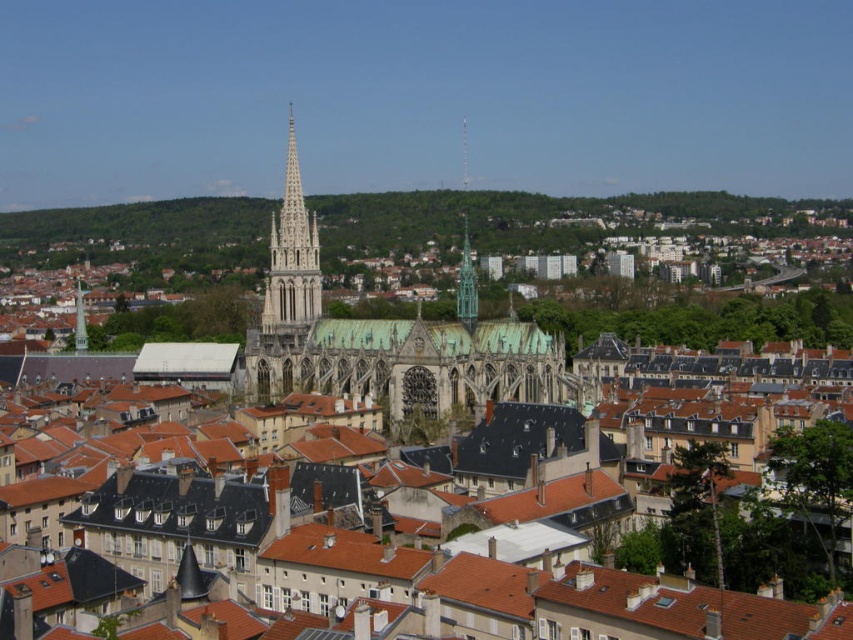
Does green copper roof at center have a lesser width compared to white stone spire at center?

In fact, green copper roof at center might be wider than white stone spire at center.

Does point (289, 272) lie behind point (282, 234)?

No, (289, 272) is in front of (282, 234).

This screenshot has width=853, height=640. What do you see at coordinates (386, 339) in the screenshot?
I see `green copper roof at center` at bounding box center [386, 339].

In order to click on green copper roof at center in this screenshot , I will do `click(386, 339)`.

Is green copper roof at center closer to the viewer compared to green glass spire at center?

Yes, green copper roof at center is closer to the viewer.

Between point (387, 353) and point (467, 234), which one is positioned in front?

Point (387, 353)

I want to click on green copper roof at center, so click(x=386, y=339).

In order to click on green copper roof at center in this screenshot , I will do `click(386, 339)`.

Between white stone spire at center and green glass spire at center, which one is positioned higher?

Positioned higher is white stone spire at center.

Which is more to the right, white stone spire at center or green glass spire at center?

From the viewer's perspective, green glass spire at center appears more on the right side.

Is point (265, 296) closer to camera compared to point (461, 262)?

Yes, it is.

Image resolution: width=853 pixels, height=640 pixels. In order to click on white stone spire at center in this screenshot , I will do point(292,253).